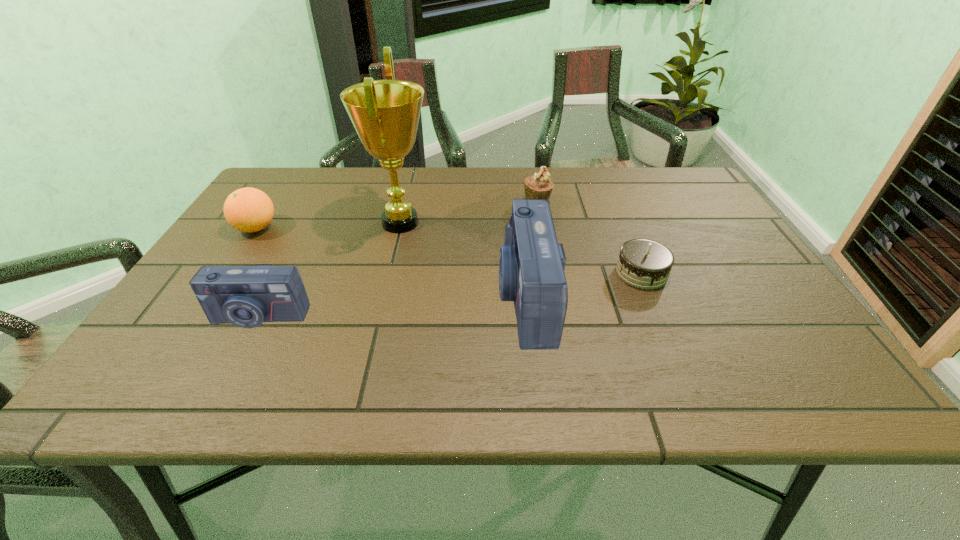
You are a GUI agent. You are given a task and a screenshot of the screen. Output one action in this format:
    pyautogui.click(x=<x>, y=<y>)
    Task: Click on the vacant space that satisfies the following two spatial constraints: 1. on the front side of the muffin; 2. on the lens of the taller camera
    The width and height of the screenshot is (960, 540).
    Given the screenshot: What is the action you would take?
    pyautogui.click(x=554, y=297)

You are a GUI agent. You are given a task and a screenshot of the screen. Output one action in this format:
    pyautogui.click(x=<x>, y=<y>)
    Task: Click on the vacant area in the image that satisfies the following two spatial constraints: 1. on the front view with handles of the shortest object; 2. on the left side of the award
    
    Given the screenshot: What is the action you would take?
    pyautogui.click(x=388, y=273)